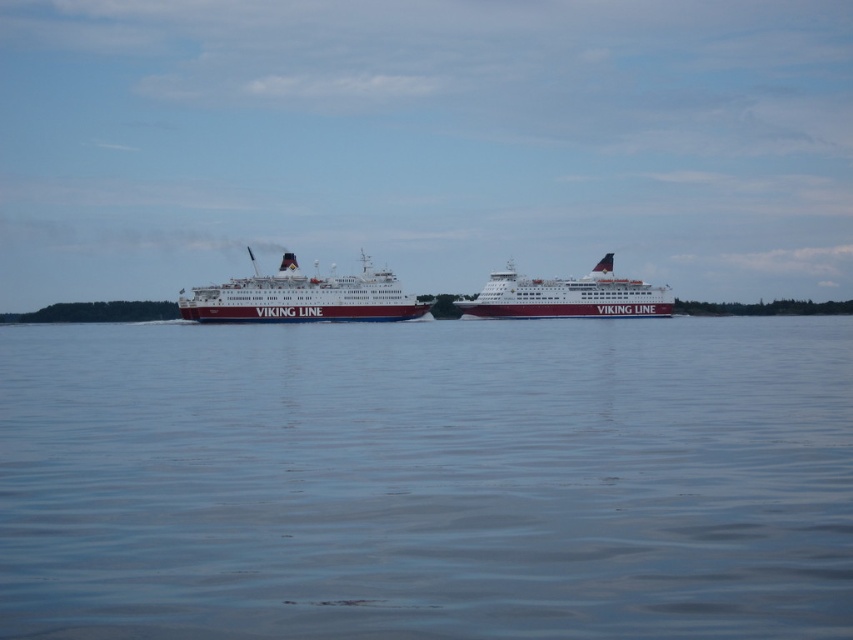
Question: Can you confirm if red polished ship at center is positioned to the right of maroon glossy ship at center?

Choices:
 (A) yes
 (B) no

Answer: (B)

Question: Is blue smooth water at center bigger than maroon glossy ship at center?

Choices:
 (A) yes
 (B) no

Answer: (A)

Question: Among these points, which one is farthest from the camera?

Choices:
 (A) (741, 508)
 (B) (596, 289)
 (C) (253, 308)

Answer: (B)

Question: Which object is the farthest from the maroon glossy ship at center?

Choices:
 (A) red polished ship at center
 (B) blue smooth water at center

Answer: (B)

Question: Does blue smooth water at center have a smaller size compared to maroon glossy ship at center?

Choices:
 (A) no
 (B) yes

Answer: (A)

Question: Which of these objects is positioned farthest from the maroon glossy ship at center?

Choices:
 (A) blue smooth water at center
 (B) red polished ship at center

Answer: (A)